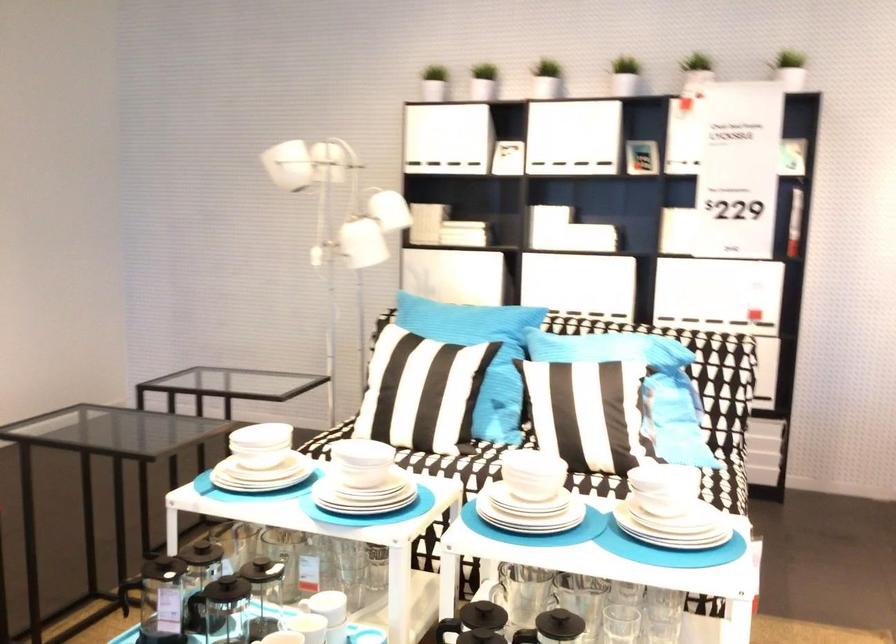
How did the camera likely rotate?

The rotation direction of the camera is right-down.